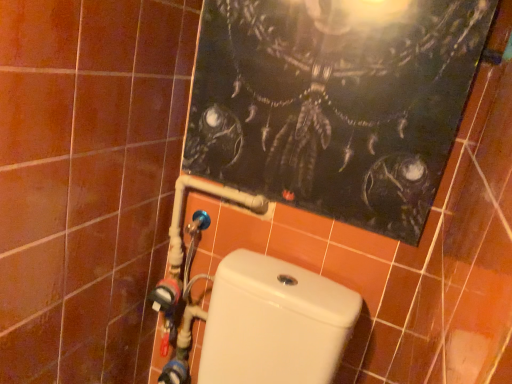
Question: Does blue plastic water pipe at lower left turn towards white glossy toilet at lower center?

Choices:
 (A) no
 (B) yes

Answer: (A)

Question: From the image's perspective, does blue plastic water pipe at lower left appear lower than white glossy toilet at lower center?

Choices:
 (A) yes
 (B) no

Answer: (B)

Question: Considering the relative positions of blue plastic water pipe at lower left and white glossy toilet at lower center in the image provided, is blue plastic water pipe at lower left to the left of white glossy toilet at lower center from the viewer's perspective?

Choices:
 (A) no
 (B) yes

Answer: (B)

Question: From the image's perspective, is blue plastic water pipe at lower left on white glossy toilet at lower center?

Choices:
 (A) no
 (B) yes

Answer: (B)

Question: Considering the relative sizes of blue plastic water pipe at lower left and white glossy toilet at lower center in the image provided, is blue plastic water pipe at lower left shorter than white glossy toilet at lower center?

Choices:
 (A) yes
 (B) no

Answer: (B)

Question: From the image's perspective, is brown matte tile at left above or below blue plastic water pipe at lower left?

Choices:
 (A) below
 (B) above

Answer: (B)

Question: Is point (46, 236) closer or farther from the camera than point (170, 246)?

Choices:
 (A) farther
 (B) closer

Answer: (B)

Question: Based on their positions, is brown matte tile at left located to the left or right of blue plastic water pipe at lower left?

Choices:
 (A) right
 (B) left

Answer: (B)

Question: Which is correct: brown matte tile at left is inside blue plastic water pipe at lower left, or outside of it?

Choices:
 (A) outside
 (B) inside

Answer: (A)

Question: From the image's perspective, relative to white glossy toilet at lower center, is brown matte tile at left above or below?

Choices:
 (A) below
 (B) above

Answer: (B)

Question: Considering the positions of brown matte tile at left and white glossy toilet at lower center in the image, is brown matte tile at left wider or thinner than white glossy toilet at lower center?

Choices:
 (A) wide
 (B) thin

Answer: (B)

Question: From a real-world perspective, is brown matte tile at left above or below white glossy toilet at lower center?

Choices:
 (A) below
 (B) above

Answer: (B)

Question: Considering their positions, is brown matte tile at left located in front of or behind white glossy toilet at lower center?

Choices:
 (A) front
 (B) behind

Answer: (B)

Question: Looking at the image, does blue plastic water pipe at lower left seem bigger or smaller compared to white glossy toilet at lower center?

Choices:
 (A) big
 (B) small

Answer: (B)

Question: Is blue plastic water pipe at lower left inside or outside of white glossy toilet at lower center?

Choices:
 (A) inside
 (B) outside

Answer: (B)